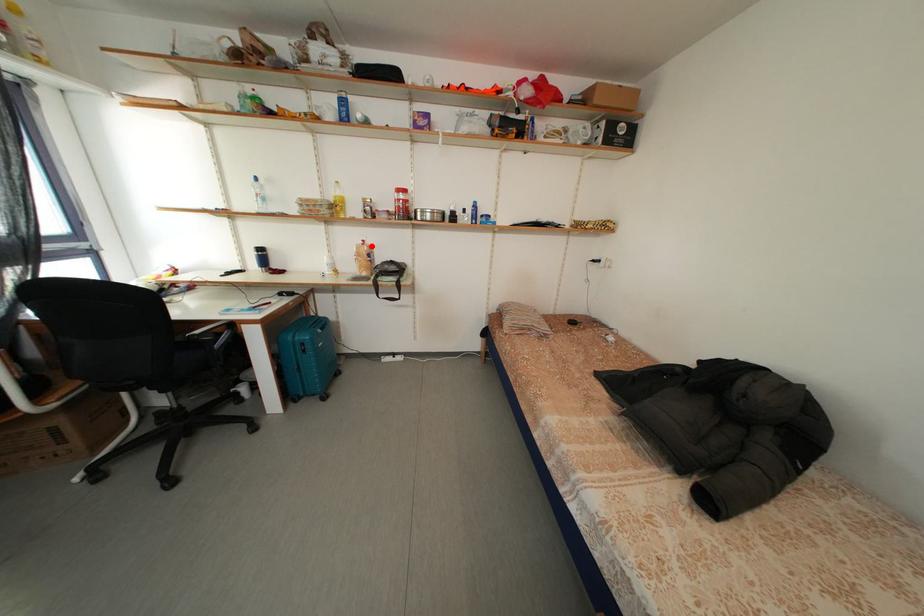
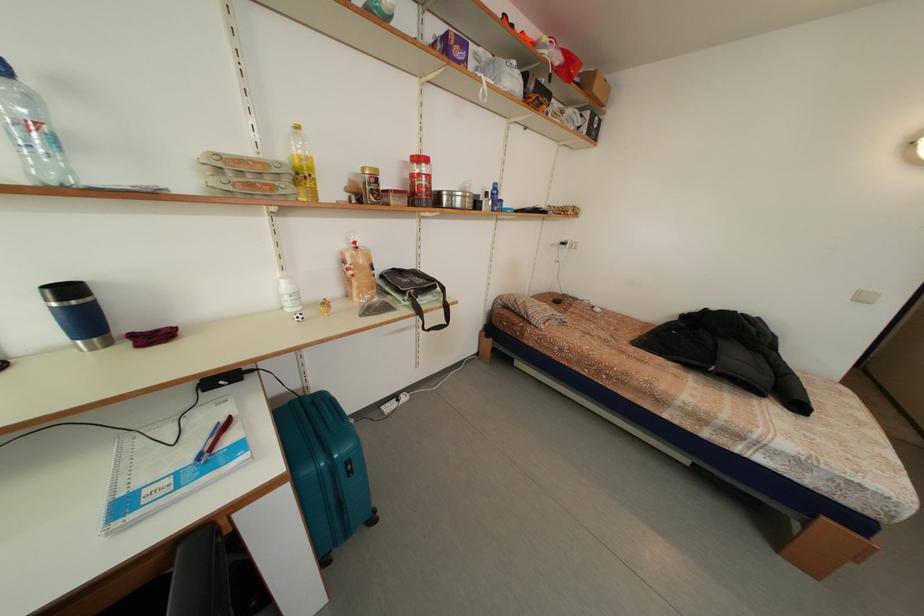
Locate, in the second image, the point that corresponds to the highlighted location in the first image.

(362, 248)